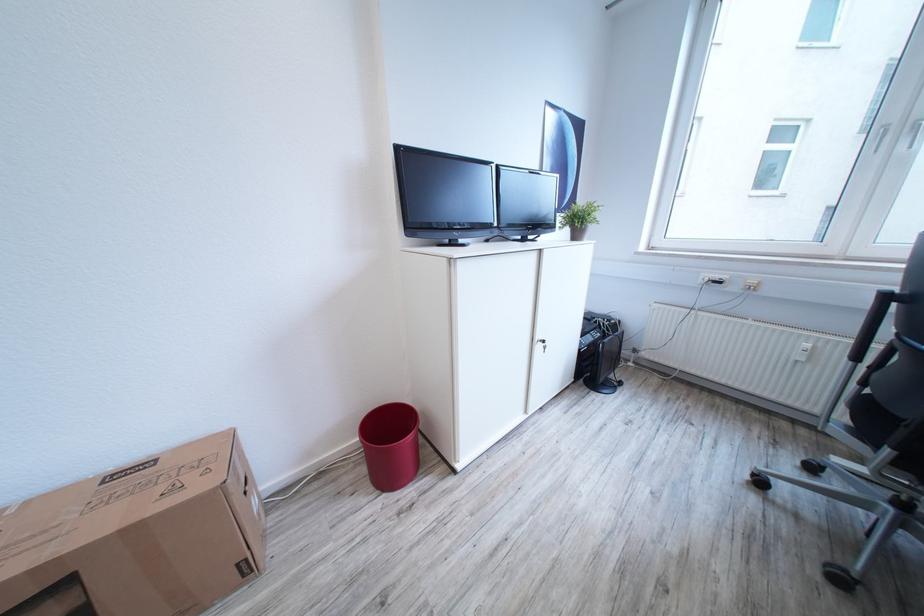
Find where to turn the radiator valve. Please return your answer as a coordinate pair (x, y).

(833, 352)